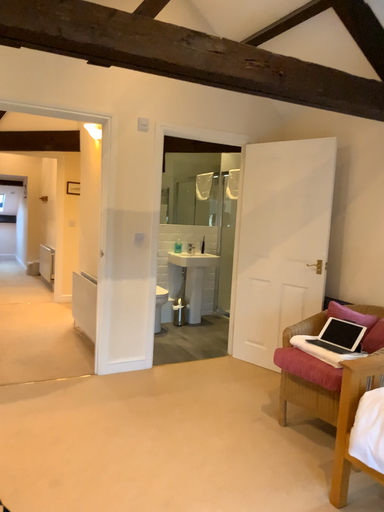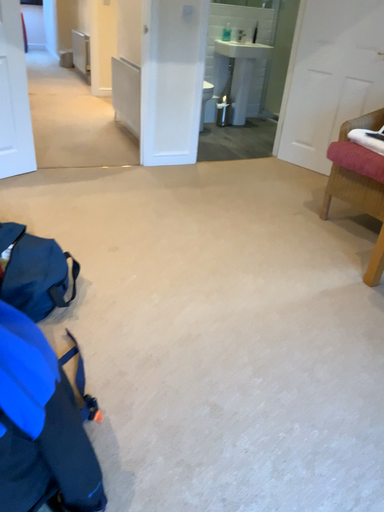
Question: How did the camera likely rotate when shooting the video?

Choices:
 (A) rotated downward
 (B) rotated upward

Answer: (A)